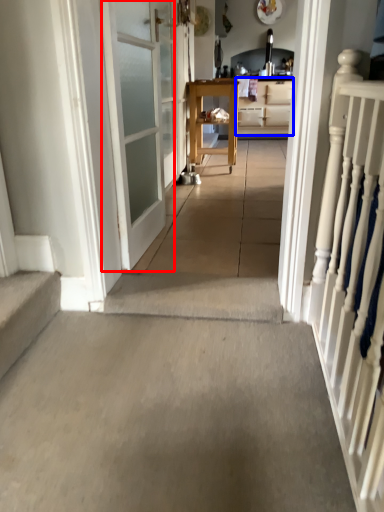
Question: Which of the following is the farthest to the observer, door (highlighted by a red box) or cabinetry (highlighted by a blue box)?

Choices:
 (A) door
 (B) cabinetry

Answer: (B)